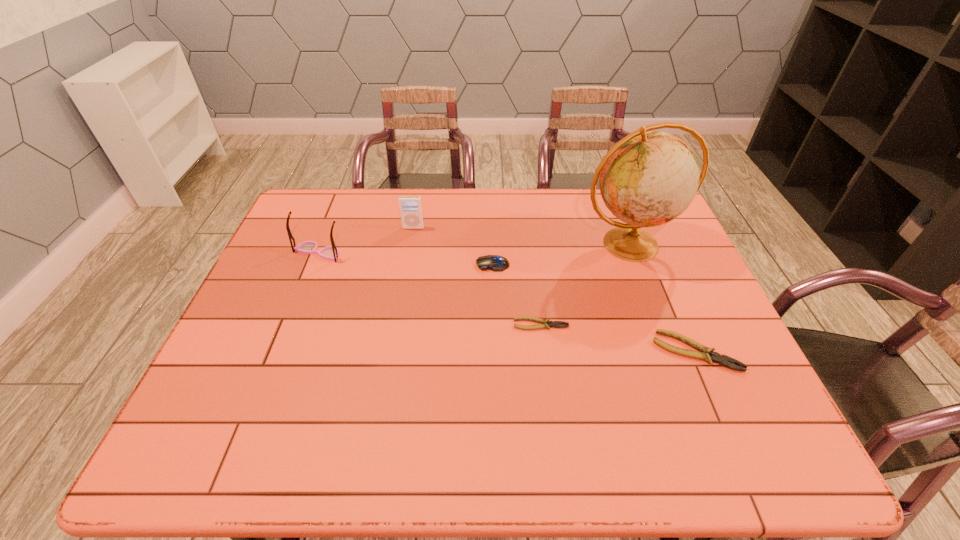
Given the evenly spaced plierss in the image, where should an extra pliers be added on the left to preserve the spacing? Please point to a vacant space. Please provide its 2D coordinates. Your answer should be formatted as a tuple, i.e. [(x, y)], where the tuple contains the x and y coordinates of a point satisfying the conditions above.

[(402, 300)]